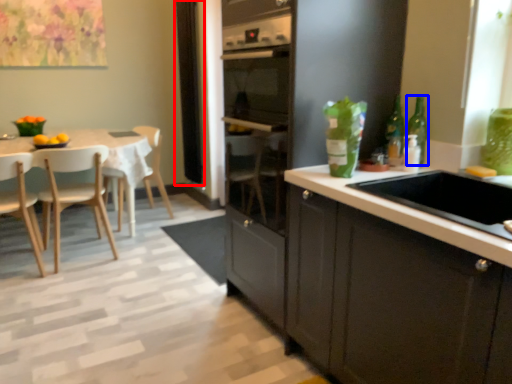
Question: Which object is further to the camera taking this photo, window screen (highlighted by a red box) or bottle (highlighted by a blue box)?

Choices:
 (A) window screen
 (B) bottle

Answer: (A)